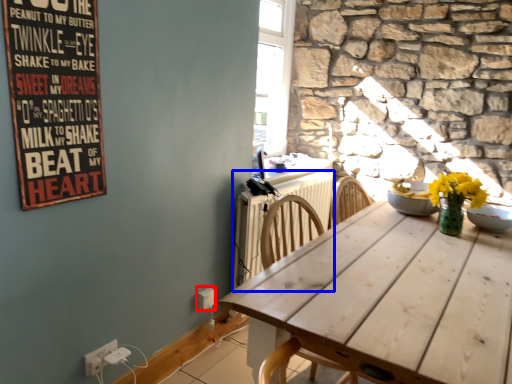
Question: Which of the following is the closest to the observer, electric outlet (highlighted by a red box) or radiator (highlighted by a blue box)?

Choices:
 (A) electric outlet
 (B) radiator

Answer: (B)